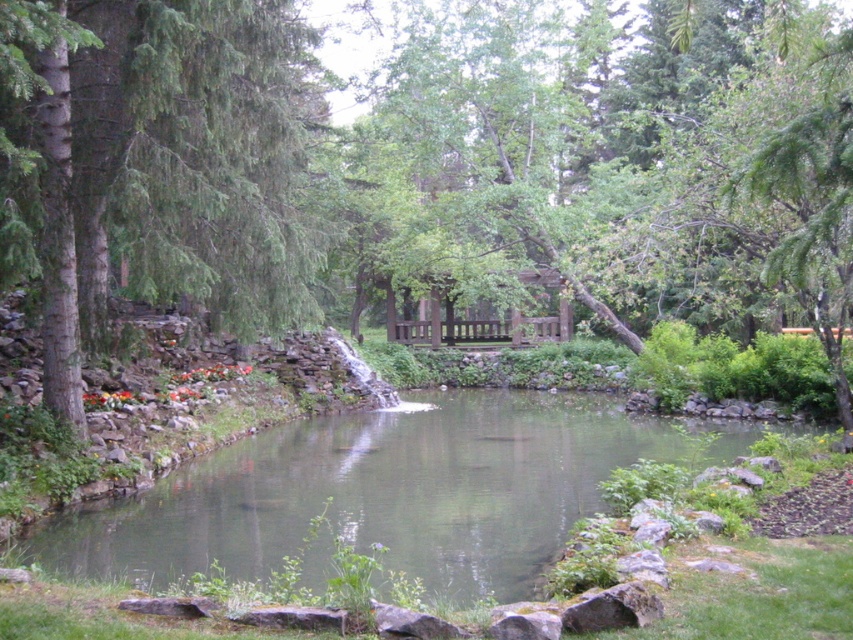
Between point (271, 493) and point (460, 326), which one is positioned in front?

Point (271, 493) is more forward.

The width and height of the screenshot is (853, 640). Identify the location of green stone lake at center. (389, 492).

From the picture: Does green evergreen tree at left have a smaller size compared to brown wooden gazebo at center?

Incorrect, green evergreen tree at left is not smaller in size than brown wooden gazebo at center.

What do you see at coordinates (154, 164) in the screenshot?
I see `green evergreen tree at left` at bounding box center [154, 164].

Where is `green evergreen tree at left`? green evergreen tree at left is located at coordinates (154, 164).

Is point (218, 13) positioned in front of point (227, 508)?

No, it is not.

Does point (607, 148) come farther from viewer compared to point (459, 554)?

Yes, point (607, 148) is behind point (459, 554).

Is point (38, 22) farther from camera compared to point (300, 422)?

No, (38, 22) is in front of (300, 422).

In order to click on green leafy tree at center in this screenshot , I will do `click(431, 170)`.